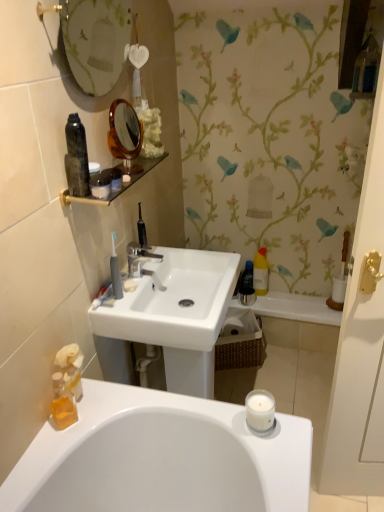
What is the approximate width of translucent orange soap at lower left, which ranks as the first toiletry in left-to-right order?

The width of translucent orange soap at lower left, which ranks as the first toiletry in left-to-right order, is 2.69 inches.

In order to face black plastic toothbrush at upper center, acting as the second toiletries starting from the left, should I rotate leftwards or rightwards?

You should rotate left by 6.614 degrees.

Describe the element at coordinates (141, 229) in the screenshot. The image size is (384, 512). I see `black plastic toothbrush at upper center, acting as the second toiletries starting from the left` at that location.

The image size is (384, 512). I want to click on matte black jar at upper center, acting as the second toiletry starting from the left, so click(101, 184).

The image size is (384, 512). Describe the element at coordinates (139, 257) in the screenshot. I see `white ceramic faucet at center` at that location.

Locate an element on the screen. yellow translucent bottle at right, marked as the third bottle in a front-to-back arrangement is located at coordinates (247, 279).

From the image's perspective, is translucent amber liquid at sink left, arranged as the first bottle when ordered from the bottom, on translucent orange soap at lower left, which is the 2th toiletry in top-to-bottom order?

No, from the image's perspective, translucent amber liquid at sink left, arranged as the first bottle when ordered from the bottom, is not over translucent orange soap at lower left, which is the 2th toiletry in top-to-bottom order.

Is translucent orange soap at lower left, acting as the first toiletry starting from the bottom, completely or partially inside translucent amber liquid at sink left, arranged as the first bottle when ordered from the bottom?

No, translucent orange soap at lower left, acting as the first toiletry starting from the bottom, is not surrounded by translucent amber liquid at sink left, arranged as the first bottle when ordered from the bottom.

Based on the photo, from a real-world perspective, which object stands above the other?

translucent orange soap at lower left, the second toiletry positioned from the right.

Relative to translucent orange soap at lower left, which ranks as the first toiletry in left-to-right order, is translucent amber liquid at sink left, the first bottle when ordered from front to back, in front or behind?

In the image, translucent amber liquid at sink left, the first bottle when ordered from front to back, appears in front of translucent orange soap at lower left, which ranks as the first toiletry in left-to-right order.

Can you tell me how much gray plastic toothbrush at center, the second toiletries from the back, and woven brown picnic basket at lower center differ in facing direction?

117 degrees.

Is point (119, 276) behind point (262, 346)?

That is False.

Could you tell me if gray plastic toothbrush at center, the second toiletries from the back, is turned towards woven brown picnic basket at lower center?

No, gray plastic toothbrush at center, the second toiletries from the back, is not oriented towards woven brown picnic basket at lower center.

Is gray plastic toothbrush at center, placed as the 1th toiletries when sorted from front to back, further to camera compared to woven brown picnic basket at lower center?

No.

Based on their positions, is black plastic toothbrush at upper center, acting as the second toiletries starting from the left, located to the left or right of translucent amber liquid at sink left, which appears as the third bottle when viewed from the right?

black plastic toothbrush at upper center, acting as the second toiletries starting from the left, is to the right of translucent amber liquid at sink left, which appears as the third bottle when viewed from the right.

Which of these two, black plastic toothbrush at upper center, acting as the second toiletries starting from the left, or translucent amber liquid at sink left, arranged as the first bottle when ordered from the bottom, is thinner?

With smaller width is black plastic toothbrush at upper center, acting as the second toiletries starting from the left.

From the picture: Would you say translucent amber liquid at sink left, the first bottle when ordered from left to right, is part of black plastic toothbrush at upper center, the 1th toiletries positioned from the back,'s contents?

No, translucent amber liquid at sink left, the first bottle when ordered from left to right, is not inside black plastic toothbrush at upper center, the 1th toiletries positioned from the back.

Is black plastic toothbrush at upper center, the 1th toiletries positioned from the back, smaller than translucent amber liquid at sink left, which appears as the third bottle when viewed from the right?

Yes.

Is matte black shelf at upper left smaller than white plastic toothbrush at left?

Actually, matte black shelf at upper left might be larger than white plastic toothbrush at left.

Would you say matte black shelf at upper left contains white plastic toothbrush at left?

No, white plastic toothbrush at left is not a part of matte black shelf at upper left.

Which of these two, matte black shelf at upper left or white plastic toothbrush at left, stands taller?

With more height is white plastic toothbrush at left.

How different are the orientations of matte black shelf at upper left and white plastic toothbrush at left in degrees?

0.482 degrees separate the facing orientations of matte black shelf at upper left and white plastic toothbrush at left.

Is gray plastic toothbrush at center, arranged as the first toiletries when viewed from the left, positioned behind matte black shelf at upper left?

Yes, the depth of gray plastic toothbrush at center, arranged as the first toiletries when viewed from the left, is greater than that of matte black shelf at upper left.

From a real-world perspective, who is located higher, gray plastic toothbrush at center, placed as the 1th toiletries when sorted from front to back, or matte black shelf at upper left?

In real-world perspective, matte black shelf at upper left is above.

In the scene shown: Is gray plastic toothbrush at center, arranged as the first toiletries when viewed from the left, aimed at matte black shelf at upper left?

No.

Considering the relative positions of black plastic toothbrush at upper center, acting as the second toiletries starting from the left, and translucent orange soap at lower left, acting as the first toiletry starting from the bottom, in the image provided, is black plastic toothbrush at upper center, acting as the second toiletries starting from the left, to the left or to the right of translucent orange soap at lower left, acting as the first toiletry starting from the bottom,?

black plastic toothbrush at upper center, acting as the second toiletries starting from the left, is to the right of translucent orange soap at lower left, acting as the first toiletry starting from the bottom.

Measure the distance between black plastic toothbrush at upper center, acting as the second toiletries starting from the left, and translucent orange soap at lower left, acting as the first toiletry starting from the bottom.

black plastic toothbrush at upper center, acting as the second toiletries starting from the left, is 23.98 inches away from translucent orange soap at lower left, acting as the first toiletry starting from the bottom.

From the image's perspective, is black plastic toothbrush at upper center, which appears as the 2th toiletries when viewed from the front, over translucent orange soap at lower left, which ranks as the first toiletry in left-to-right order?

Yes, from the image's perspective, black plastic toothbrush at upper center, which appears as the 2th toiletries when viewed from the front, is over translucent orange soap at lower left, which ranks as the first toiletry in left-to-right order.

Is black plastic toothbrush at upper center, acting as the second toiletries starting from the left, facing away from translucent orange soap at lower left, which ranks as the first toiletry in left-to-right order?

That's not correct — black plastic toothbrush at upper center, acting as the second toiletries starting from the left, is not looking away from translucent orange soap at lower left, which ranks as the first toiletry in left-to-right order.

Is matte black jar at upper center, which is counted as the first toiletry, starting from the top, in front of or behind black plastic toothbrush at upper center, which appears as the 2th toiletries when viewed from the front, in the image?

matte black jar at upper center, which is counted as the first toiletry, starting from the top, is in front of black plastic toothbrush at upper center, which appears as the 2th toiletries when viewed from the front.

Would you say matte black jar at upper center, which is counted as the first toiletry, starting from the top, is outside black plastic toothbrush at upper center, the 1th toiletries positioned from the back?

Yes, matte black jar at upper center, which is counted as the first toiletry, starting from the top, is located beyond the bounds of black plastic toothbrush at upper center, the 1th toiletries positioned from the back.

In the image, is matte black jar at upper center, the first toiletry viewed from the right, on the left side or the right side of black plastic toothbrush at upper center, which appears as the 2th toiletries when viewed from the front?

matte black jar at upper center, the first toiletry viewed from the right, is positioned on black plastic toothbrush at upper center, which appears as the 2th toiletries when viewed from the front,'s left side.

Is the surface of matte black jar at upper center, which is counted as the first toiletry, starting from the top, in direct contact with black plastic toothbrush at upper center, the 1th toiletries positioned from the back?

matte black jar at upper center, which is counted as the first toiletry, starting from the top, is not next to black plastic toothbrush at upper center, the 1th toiletries positioned from the back, and they're not touching.

Locate an element on the screen. This screenshot has height=512, width=384. the 1st toiletry above when counting from the translucent amber liquid at sink left, which appears as the third bottle when viewed from the right (from the image's perspective) is located at coordinates (69, 369).

I want to click on picnic basket that appears behind the gray plastic toothbrush at center, arranged as the first toiletries when viewed from the left, so click(239, 341).

Estimate the real-world distances between objects in this image. Which object is closer to translucent orange soap at lower left, which is the 2th toiletry in top-to-bottom order, matte glass mirror at upper center or white matte soap at upper center?

white matte soap at upper center is positioned closer to the anchor translucent orange soap at lower left, which is the 2th toiletry in top-to-bottom order.

Which object lies nearer to the anchor point woven brown picnic basket at lower center, yellow translucent bottle at right, the second bottle in the right-to-left sequence, or matte glass mirror at upper center?

Based on the image, yellow translucent bottle at right, the second bottle in the right-to-left sequence, appears to be nearer to woven brown picnic basket at lower center.

Consider the image. Based on their spatial positions, is white matte soap at upper center or yellow translucent bottle at right, positioned as the 2th bottle in bottom-to-top order, further from woven brown picnic basket at lower center?

Among the two, white matte soap at upper center is located further to woven brown picnic basket at lower center.

Which object lies nearer to the anchor point matte glass mirror at upper center, white matte soap at upper center or gray plastic toothbrush at center, placed as the 1th toiletries when sorted from front to back?

The object closer to matte glass mirror at upper center is gray plastic toothbrush at center, placed as the 1th toiletries when sorted from front to back.

Which object lies further to the anchor point matte black shelf at upper left, translucent orange soap at lower left, which ranks as the first toiletry in left-to-right order, or matte black jar at upper center, which is the 2th toiletry from bottom to top?

translucent orange soap at lower left, which ranks as the first toiletry in left-to-right order, is positioned further to the anchor matte black shelf at upper left.

From the image, which object appears to be farther from matte glass mirror at upper center, white plastic toothbrush at left or woven brown picnic basket at lower center?

woven brown picnic basket at lower center lies further to matte glass mirror at upper center than the other object.

Based on their spatial positions, is white ceramic faucet at center or white plastic toothbrush at left further from matte black jar at upper center, the first toiletry viewed from the right?

white ceramic faucet at center lies further to matte black jar at upper center, the first toiletry viewed from the right, than the other object.

From the image, which object appears to be farther from gray plastic toothbrush at center, which appears as the 2th toiletries when viewed from the right, black plastic toothbrush at upper center, the first toiletries when ordered from right to left, or yellow translucent bottle at right, the second bottle in the right-to-left sequence?

yellow translucent bottle at right, the second bottle in the right-to-left sequence, is further to gray plastic toothbrush at center, which appears as the 2th toiletries when viewed from the right.

I want to click on plumbing fixture between black plastic toothbrush at upper center, which appears as the 2th toiletries when viewed from the front, and translucent amber liquid at sink left, the first bottle when ordered from front to back, from top to bottom, so point(139,257).

Where is `plumbing fixture between white matte soap at upper center and woven brown picnic basket at lower center along the z-axis`? plumbing fixture between white matte soap at upper center and woven brown picnic basket at lower center along the z-axis is located at coordinates (139, 257).

Where is `balustrade between matte glass mirror at upper center and white plastic toothbrush at left vertically`? balustrade between matte glass mirror at upper center and white plastic toothbrush at left vertically is located at coordinates (121, 182).

Identify the location of balustrade between translucent amber liquid at sink left, the first bottle when ordered from left to right, and yellow translucent bottle at right, the second bottle in the right-to-left sequence, in the front-back direction. (121, 182).